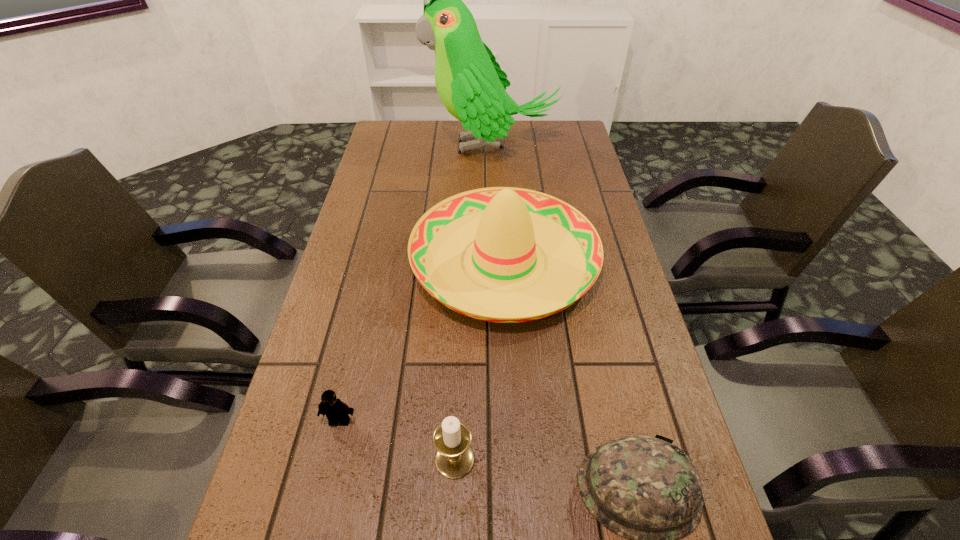
Image resolution: width=960 pixels, height=540 pixels. Identify the location of vacant point at the right edge. (639, 316).

Where is `free space at the far left corner`? This screenshot has width=960, height=540. free space at the far left corner is located at coordinates (392, 123).

The height and width of the screenshot is (540, 960). Find the location of `vacant space at the far right corner of the desktop`. vacant space at the far right corner of the desktop is located at coordinates (560, 145).

Identify the location of object that stands as the closest to the candle holder. (335, 410).

Image resolution: width=960 pixels, height=540 pixels. I want to click on the third closest object to the headwear, so click(335, 410).

Where is `vacant position in the image that satisfies the following two spatial constraints: 1. on the back side of the fourth shortest object; 2. on the beak of the farthest object`? The width and height of the screenshot is (960, 540). vacant position in the image that satisfies the following two spatial constraints: 1. on the back side of the fourth shortest object; 2. on the beak of the farthest object is located at coordinates (497, 146).

Identify the location of blank space that satisfies the following two spatial constraints: 1. on the beak of the second tallest object; 2. on the left side of the tallest object. (495, 260).

I want to click on free region that satisfies the following two spatial constraints: 1. on the face of the Lego; 2. on the right side of the third shortest object, so click(331, 458).